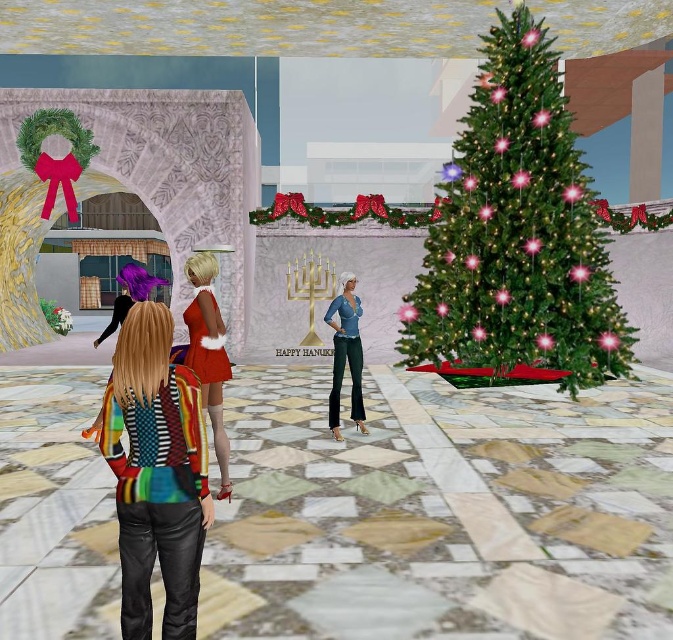
You are attending a holiday party and see a shiny red dress at center and denim jeans at center. Which clothing item is located below the other?

The shiny red dress at center is positioned under the denim jeans at center, so the dress is below the jeans.

You are a delivery person who needs to place a package on the green matte christmas tree at right without moving the multicolored striped sweater at center. Is this possible?

The multicolored striped sweater at center is behind the green matte christmas tree at right, so you can place the package on the green matte christmas tree at right without moving the sweater since it is not in front of the tree.

You are a fashion designer who wants to display the shiny red dress at center and denim jeans at center in a runway show. The runway is 8 feet long. Can both items be placed on the runway without overlapping?

The distance between the shiny red dress at center and denim jeans at center is 7.60 feet, which is less than the runway length of 8 feet. Therefore, both items can be placed on the runway without overlapping.